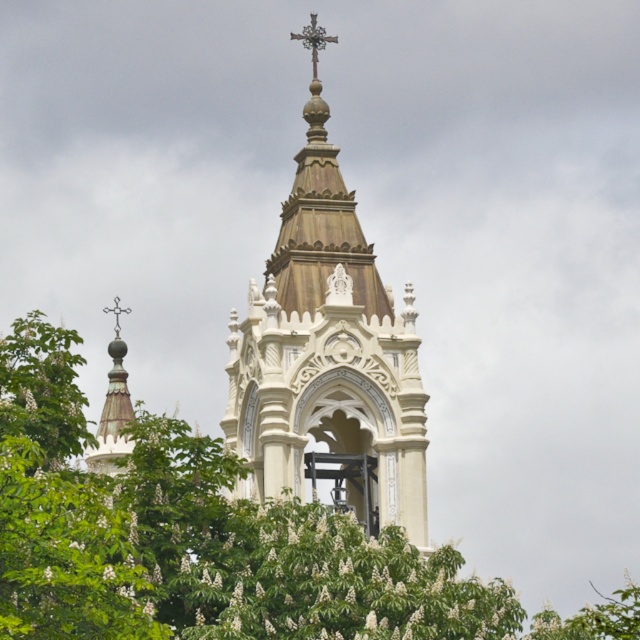
Question: Which point is farther to the camera?

Choices:
 (A) (376, 432)
 (B) (116, 332)

Answer: (B)

Question: Does green leafy tree at center appear on the left side of polished bronze cross at upper center?

Choices:
 (A) no
 (B) yes

Answer: (B)

Question: Is green leafy tree at center to the right of white carved stone bell tower at center from the viewer's perspective?

Choices:
 (A) yes
 (B) no

Answer: (B)

Question: Which is farther from the green leafy tree at center?

Choices:
 (A) white carved stone bell tower at center
 (B) silver metallic cross at upper left

Answer: (B)

Question: Which of the following is the farthest from the observer?

Choices:
 (A) (308, 29)
 (B) (118, 298)
 (C) (29, 596)

Answer: (B)

Question: Is the position of polished bronze cross at upper center more distant than that of silver metallic cross at upper left?

Choices:
 (A) yes
 (B) no

Answer: (B)